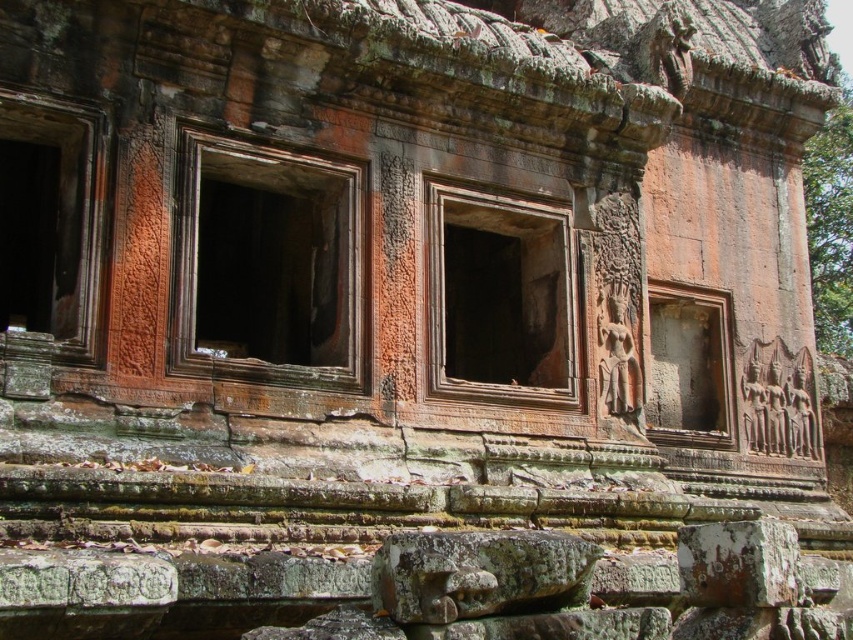
Question: Considering the real-world distances, which object is farthest from the brown stone window at left?

Choices:
 (A) rustic stone window at center
 (B) brown stone window at center

Answer: (A)

Question: Which object is farther from the camera taking this photo?

Choices:
 (A) brown stone window at left
 (B) rustic stone window at center
 (C) carved stone relief at center

Answer: (C)

Question: Does brown stone window at left have a larger size compared to carved stone relief at center?

Choices:
 (A) no
 (B) yes

Answer: (B)

Question: Can you confirm if rustic stone window at center is wider than carved stone relief at center?

Choices:
 (A) yes
 (B) no

Answer: (A)

Question: Among these points, which one is farthest from the camera?

Choices:
 (A) (531, 220)
 (B) (296, 284)
 (C) (91, 339)
 (D) (711, 426)

Answer: (D)

Question: Does brown stone window at center have a smaller size compared to rustic stone window at center?

Choices:
 (A) no
 (B) yes

Answer: (A)